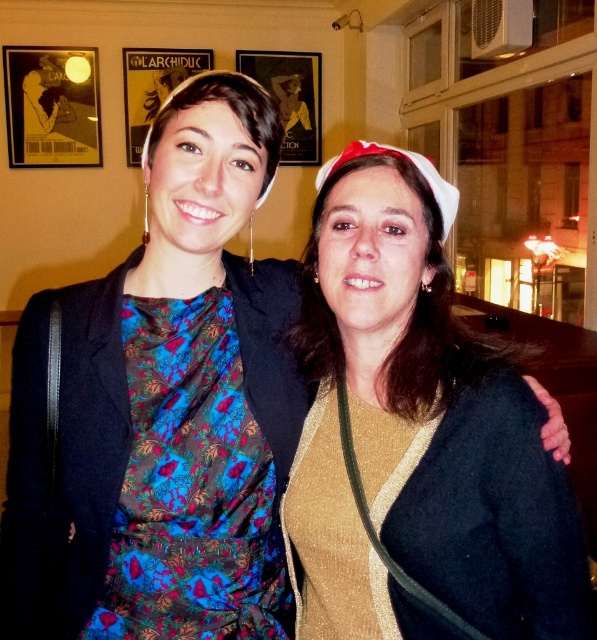
Can you confirm if gold glittery sweater at center is positioned above floral print fabric dress at left?

Yes.

Which is in front, point (484, 595) or point (207, 582)?

Point (484, 595) is more forward.

The image size is (597, 640). What do you see at coordinates (416, 435) in the screenshot? I see `gold glittery sweater at center` at bounding box center [416, 435].

The image size is (597, 640). I want to click on gold glittery sweater at center, so click(416, 435).